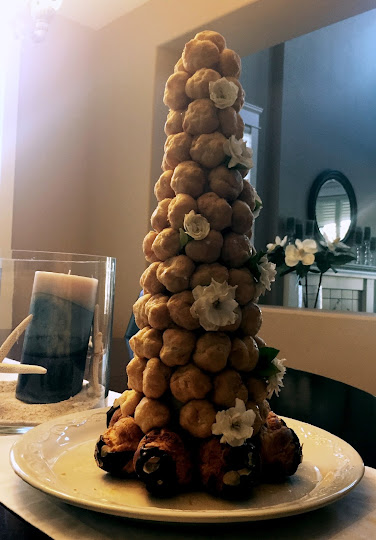
This screenshot has height=540, width=376. Identify the location of mirror. (329, 209).